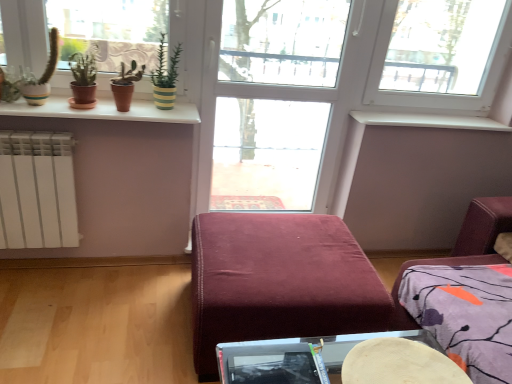
In order to click on free region under white plastic window at upper right (from a real-world perspective) in this screenshot , I will do `click(413, 106)`.